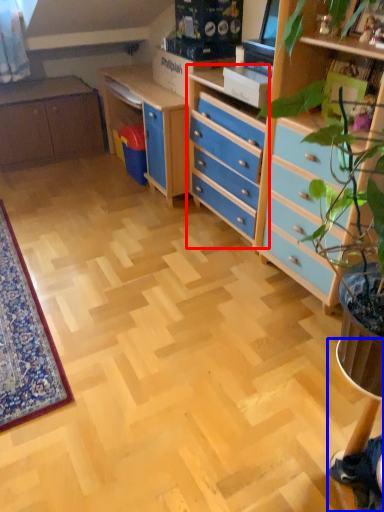
Question: Which object appears closest to the camera in this image, chest of drawers (highlighted by a red box) or computer desk (highlighted by a blue box)?

Choices:
 (A) chest of drawers
 (B) computer desk

Answer: (B)